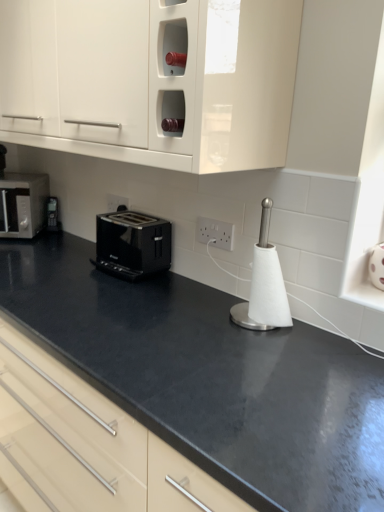
Question: Can you confirm if white paper towel holder at center is positioned to the right of white plastic electric outlet at center, placed as the first electric outlet when sorted from bottom to top?

Choices:
 (A) no
 (B) yes

Answer: (B)

Question: Considering the relative sizes of white paper towel holder at center and white plastic electric outlet at center, which is the 2th electric outlet from left to right, in the image provided, is white paper towel holder at center smaller than white plastic electric outlet at center, which is the 2th electric outlet from left to right,?

Choices:
 (A) yes
 (B) no

Answer: (B)

Question: From the image's perspective, is white paper towel holder at center under white plastic electric outlet at center, placed as the first electric outlet when sorted from bottom to top?

Choices:
 (A) no
 (B) yes

Answer: (B)

Question: From a real-world perspective, is white paper towel holder at center located beneath white plastic electric outlet at center, which is the first electric outlet in right-to-left order?

Choices:
 (A) no
 (B) yes

Answer: (B)

Question: From a real-world perspective, is white paper towel holder at center on white plastic electric outlet at center, placed as the first electric outlet when sorted from bottom to top?

Choices:
 (A) no
 (B) yes

Answer: (A)

Question: Is white glossy cabinet at upper center in front of or behind black glossy toaster at center in the image?

Choices:
 (A) behind
 (B) front

Answer: (B)

Question: From a real-world perspective, relative to black glossy toaster at center, is white glossy cabinet at upper center vertically above or below?

Choices:
 (A) above
 (B) below

Answer: (A)

Question: Would you say white glossy cabinet at upper center is to the left or to the right of black glossy toaster at center in the picture?

Choices:
 (A) right
 (B) left

Answer: (B)

Question: Is white glossy cabinet at upper center inside the boundaries of black glossy toaster at center, or outside?

Choices:
 (A) inside
 (B) outside

Answer: (B)

Question: In terms of size, does matte silver toaster at left appear bigger or smaller than black glossy toaster at center?

Choices:
 (A) small
 (B) big

Answer: (B)

Question: Is matte silver toaster at left taller or shorter than black glossy toaster at center?

Choices:
 (A) tall
 (B) short

Answer: (A)

Question: From the image's perspective, is matte silver toaster at left above or below black glossy toaster at center?

Choices:
 (A) above
 (B) below

Answer: (A)

Question: Is matte silver toaster at left to the left or to the right of black glossy toaster at center in the image?

Choices:
 (A) right
 (B) left

Answer: (B)

Question: Considering the positions of point (21, 205) and point (246, 151), is point (21, 205) closer or farther from the camera than point (246, 151)?

Choices:
 (A) farther
 (B) closer

Answer: (A)

Question: Is matte silver toaster at left bigger or smaller than white glossy cabinet at upper center?

Choices:
 (A) big
 (B) small

Answer: (B)